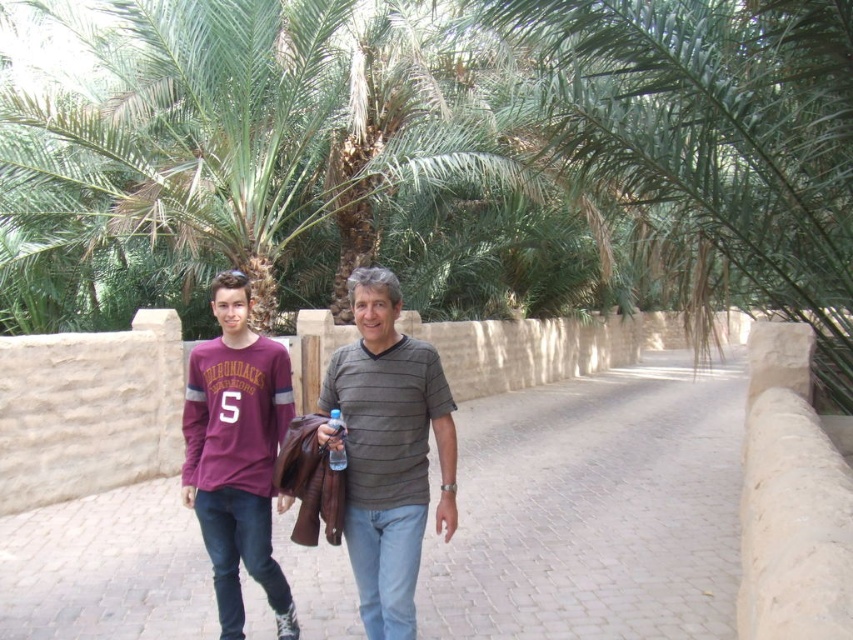
Can you confirm if paved stone walkway at center is bigger than maroon jersey at center?

Indeed, paved stone walkway at center has a larger size compared to maroon jersey at center.

Locate an element on the screen. This screenshot has width=853, height=640. paved stone walkway at center is located at coordinates (595, 509).

Does maroon jersey at center have a smaller size compared to transparent plastic bottle at center?

Incorrect, maroon jersey at center is not smaller in size than transparent plastic bottle at center.

Find the location of a particular element. This screenshot has height=640, width=853. maroon jersey at center is located at coordinates (236, 452).

Locate an element on the screen. This screenshot has height=640, width=853. maroon jersey at center is located at coordinates (236, 452).

Does paved stone walkway at center have a greater height compared to transparent plastic bottle at center?

Indeed, paved stone walkway at center has a greater height compared to transparent plastic bottle at center.

Can you confirm if paved stone walkway at center is positioned above transparent plastic bottle at center?

Incorrect, paved stone walkway at center is not positioned above transparent plastic bottle at center.

Is point (653, 452) positioned behind point (335, 429)?

Yes, it is.

Locate an element on the screen. paved stone walkway at center is located at coordinates (595, 509).